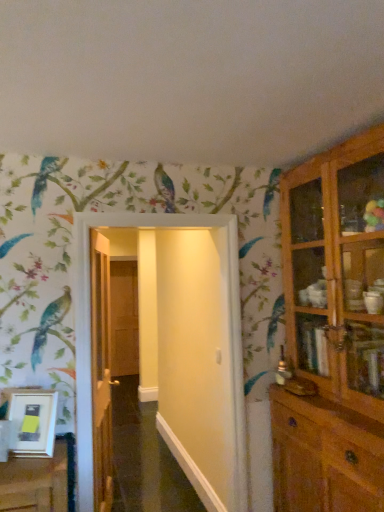
Question: Is wooden door at center, which ranks as the 2th door in left-to-right order, wider or thinner than brown wooden door at center, arranged as the third door when viewed from the right?

Choices:
 (A) wide
 (B) thin

Answer: (B)

Question: From the image's perspective, relative to brown wooden door at center, the first door in the back-to-front sequence, is wooden door at center, the second door in the right-to-left sequence, above or below?

Choices:
 (A) above
 (B) below

Answer: (A)

Question: Which object is the farthest from the white glossy door at center, the first door viewed from the right?

Choices:
 (A) brown wooden door at center, the 1th door in the left-to-right sequence
 (B) white matte picture frame at lower left
 (C) wooden door at center, the second door in the right-to-left sequence
 (D) wooden cabinet at right

Answer: (A)

Question: Estimate the real-world distances between objects in this image. Which object is farther from the white matte picture frame at lower left?

Choices:
 (A) wooden cabinet at right
 (B) white glossy door at center, which appears as the 3th door when viewed from the back
 (C) wooden door at center, the 2th door viewed from the back
 (D) brown wooden door at center, the first door in the back-to-front sequence

Answer: (D)